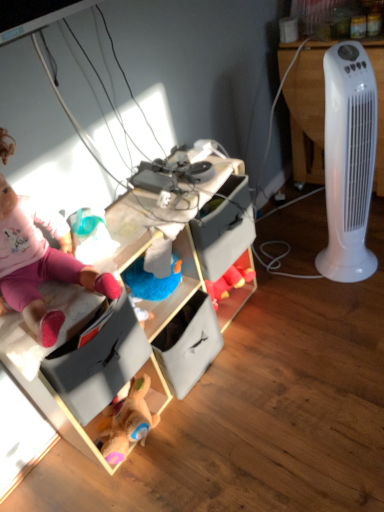
Question: Is white plastic tower fan at right at the left side of wooden toy storage at center?

Choices:
 (A) yes
 (B) no

Answer: (B)

Question: From a real-world perspective, is white plastic tower fan at right beneath wooden toy storage at center?

Choices:
 (A) yes
 (B) no

Answer: (B)

Question: Does white plastic tower fan at right contain wooden toy storage at center?

Choices:
 (A) yes
 (B) no

Answer: (B)

Question: Can you confirm if white plastic tower fan at right is shorter than wooden toy storage at center?

Choices:
 (A) no
 (B) yes

Answer: (A)

Question: From the image's perspective, is white plastic tower fan at right on wooden toy storage at center?

Choices:
 (A) no
 (B) yes

Answer: (B)

Question: Considering the relative sizes of white plastic tower fan at right and wooden toy storage at center in the image provided, is white plastic tower fan at right bigger than wooden toy storage at center?

Choices:
 (A) yes
 (B) no

Answer: (B)

Question: Is white plastic tower fan at right further to the viewer compared to pink fabric doll at upper left?

Choices:
 (A) no
 (B) yes

Answer: (B)

Question: From the image's perspective, is white plastic tower fan at right located beneath pink fabric doll at upper left?

Choices:
 (A) yes
 (B) no

Answer: (B)

Question: Is white plastic tower fan at right in front of pink fabric doll at upper left?

Choices:
 (A) no
 (B) yes

Answer: (A)

Question: Is white plastic tower fan at right positioned beyond the bounds of pink fabric doll at upper left?

Choices:
 (A) yes
 (B) no

Answer: (A)

Question: Does white plastic tower fan at right appear on the left side of pink fabric doll at upper left?

Choices:
 (A) no
 (B) yes

Answer: (A)

Question: Can you confirm if white plastic tower fan at right is thinner than pink fabric doll at upper left?

Choices:
 (A) no
 (B) yes

Answer: (A)

Question: Can you confirm if wooden toy storage at center is thinner than pink fabric doll at upper left?

Choices:
 (A) yes
 (B) no

Answer: (A)